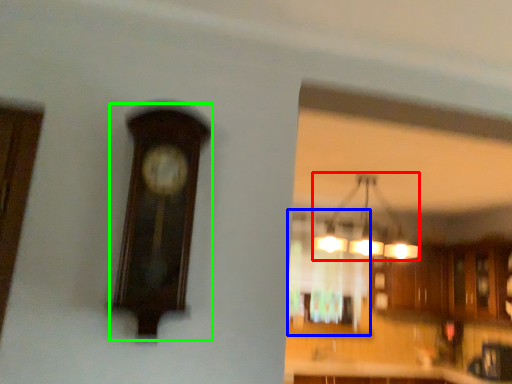
Question: Considering the real-world distances, which object is farthest from lamp (highlighted by a red box)? window (highlighted by a blue box) or clock (highlighted by a green box)?

Choices:
 (A) window
 (B) clock

Answer: (B)